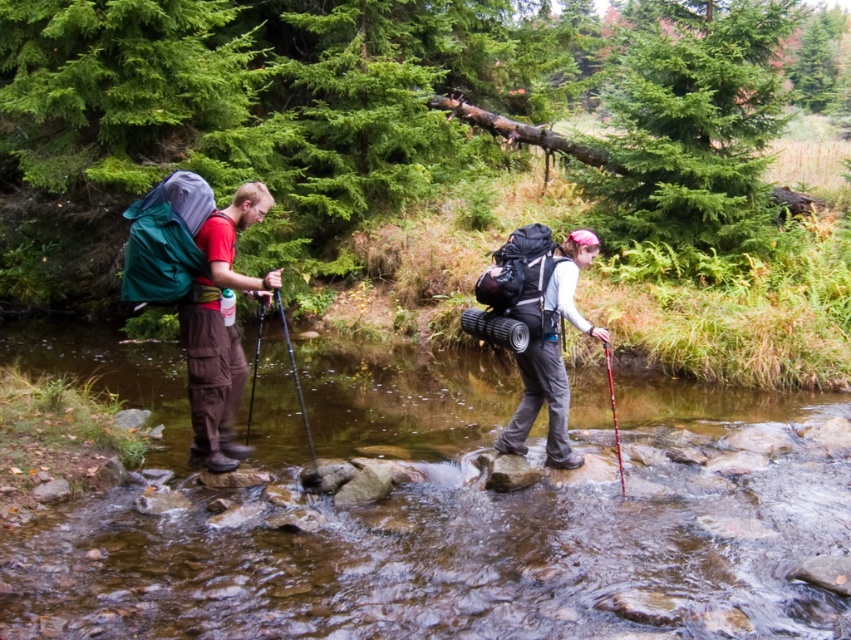
Is matte green backpack at left shorter than matte black backpack at center?

No, matte green backpack at left is not shorter than matte black backpack at center.

Find the location of `matte green backpack at left`. matte green backpack at left is located at coordinates (220, 330).

Can you confirm if clear water at center is taller than matte black backpack at center?

Incorrect, clear water at center's height is not larger of matte black backpack at center's.

Who is more forward, [20,557] or [503,436]?

Point [20,557] is more forward.

Describe the element at coordinates (448, 516) in the screenshot. I see `clear water at center` at that location.

Find the location of a particular element. Image resolution: width=851 pixels, height=640 pixels. clear water at center is located at coordinates (448, 516).

Which is above, clear water at center or matte green backpack at left?

matte green backpack at left is above.

Can you confirm if clear water at center is positioned above matte green backpack at left?

Incorrect, clear water at center is not positioned above matte green backpack at left.

Which is in front, point (344, 518) or point (255, 216)?

Point (344, 518) is more forward.

I want to click on clear water at center, so click(x=448, y=516).